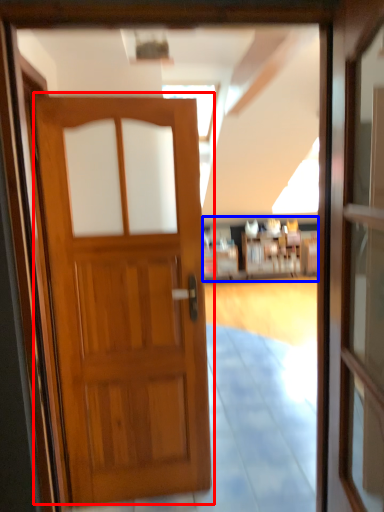
Question: Which point is closer to the camera, door (highlighted by a red box) or hotel lobby (highlighted by a blue box)?

Choices:
 (A) door
 (B) hotel lobby

Answer: (A)